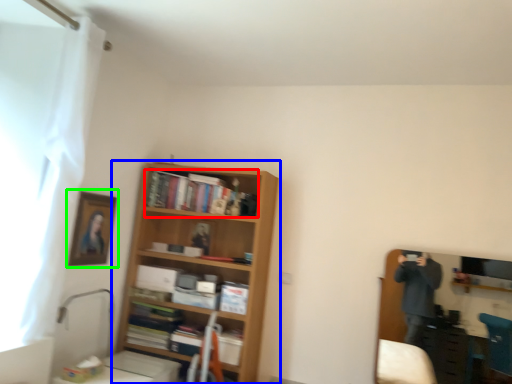
Question: Estimate the real-world distances between objects in this image. Which object is farther from book (highlighted by a red box), shelf (highlighted by a blue box) or picture frame (highlighted by a green box)?

Choices:
 (A) shelf
 (B) picture frame

Answer: (B)